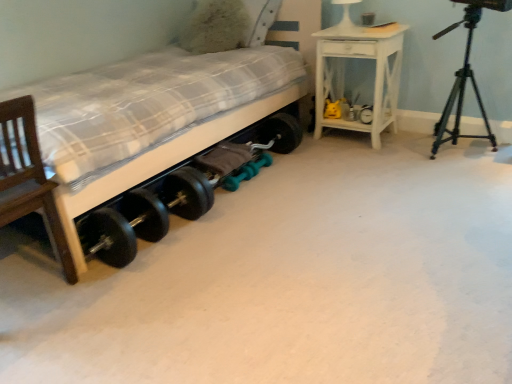
I want to click on free space in front of white painted wood nightstand at upper right, so click(x=359, y=158).